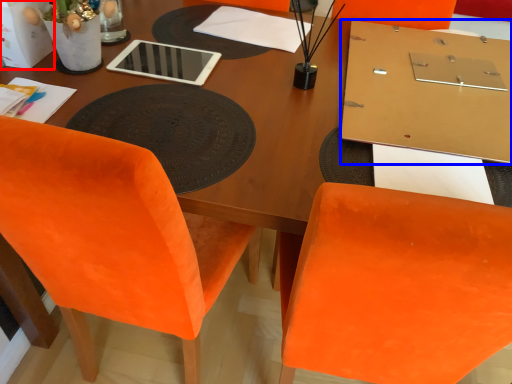
Question: Which of the following is the closest to the observer, box (highlighted by a red box) or table (highlighted by a blue box)?

Choices:
 (A) box
 (B) table

Answer: (B)